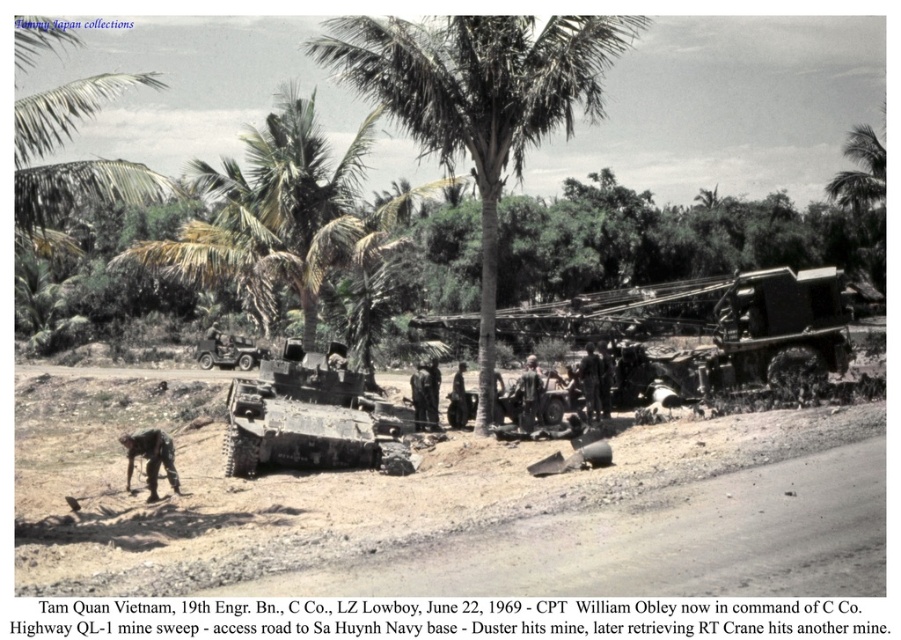
Is matte green jeep at center-left closer to camera compared to camouflage fabric uniform at center?

No, matte green jeep at center-left is further to the viewer.

Which is below, matte green jeep at center-left or camouflage fabric uniform at center?

camouflage fabric uniform at center is lower down.

Does point (217, 364) come in front of point (530, 374)?

No, (217, 364) is further to viewer.

The image size is (901, 640). Identify the location of matte green jeep at center-left. tap(226, 352).

Does brown dirt track at center have a larger size compared to dark gray uniform at center?

Yes.

Between point (311, 561) and point (586, 392), which one is positioned behind?

The point (586, 392) is more distant.

The height and width of the screenshot is (640, 901). I want to click on brown dirt track at center, so click(x=316, y=484).

This screenshot has width=901, height=640. Describe the element at coordinates (590, 381) in the screenshot. I see `dark gray uniform at center` at that location.

Does dark gray uniform at center come in front of dark brown leather boots at center?

Yes, dark gray uniform at center is closer to the viewer.

Is point (598, 362) closer to camera compared to point (428, 371)?

Yes, point (598, 362) is in front of point (428, 371).

Find the location of `dark gray uniform at center`. dark gray uniform at center is located at coordinates (590, 381).